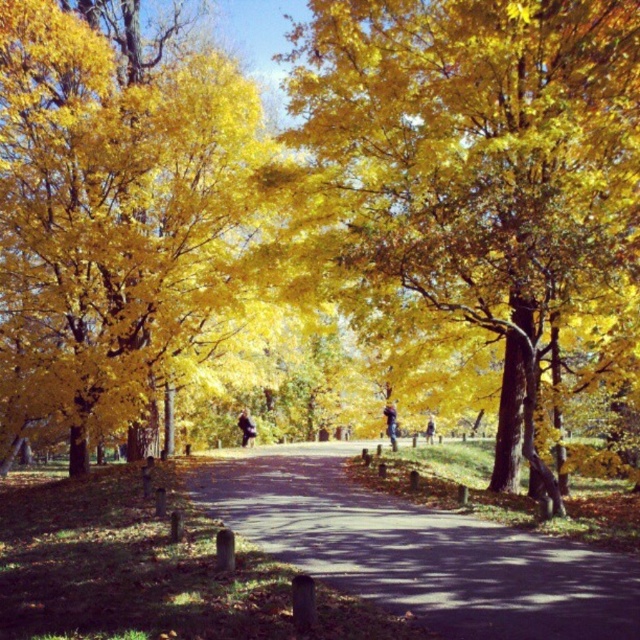
You are standing on the blue denim jeans at center and want to walk forward. Which direction will you step onto the dark asphalt path at center?

Since the dark asphalt path at center is in front of the blue denim jeans at center, stepping forward from the blue denim jeans at center will lead you onto the dark asphalt path at center.

You are standing on the path in the autumn scene and see both the golden leafy tree at center and the dark blue jeans at center. Which object is closer to you?

The golden leafy tree at center is closer to you because it is in front of the dark blue jeans at center.